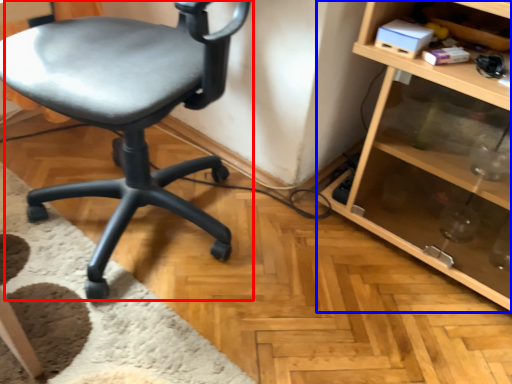
Question: Which object appears farthest to the camera in this image, chair (highlighted by a red box) or shelf (highlighted by a blue box)?

Choices:
 (A) chair
 (B) shelf

Answer: (B)